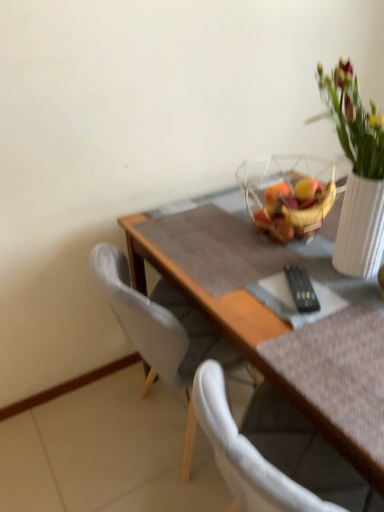
Image resolution: width=384 pixels, height=512 pixels. In order to click on vacant area that is in front of transparent glass bowl at upper right in this screenshot , I will do `click(294, 266)`.